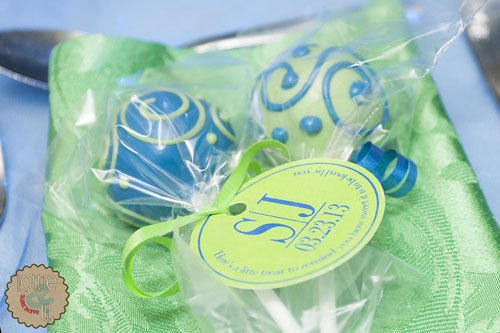
At what (x,y) coordinates should I click in order to perform the action: click on silk fabric. Please return your answer as a coordinate pair (x, y). The height and width of the screenshot is (333, 500). Looking at the image, I should click on (450, 250).